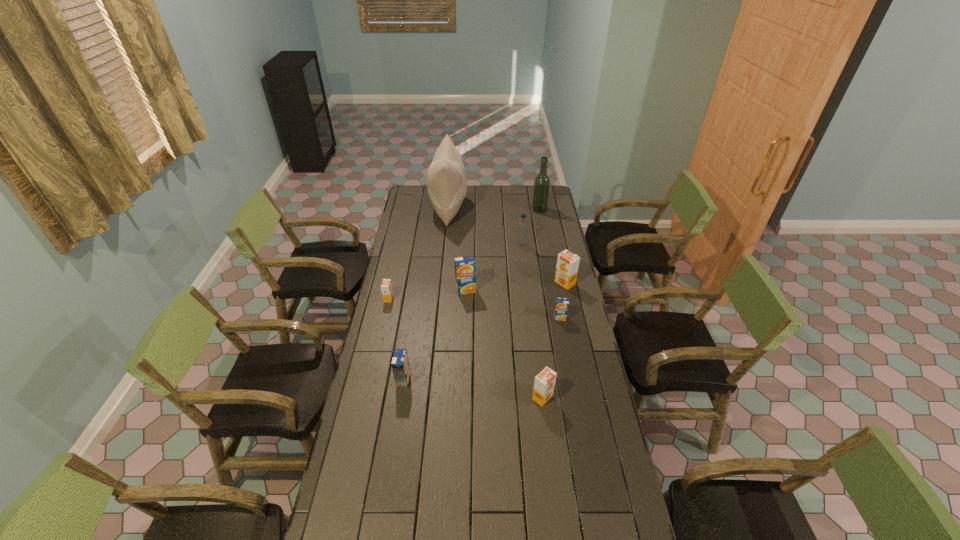
Find the location of a particular element. The width and height of the screenshot is (960, 540). free point located 0.140m on the back of the farthest orange orange juice is located at coordinates (560, 259).

Find the location of a particular element. free location located on the left of the second biggest orange orange juice is located at coordinates (x=468, y=397).

I want to click on vacant space located 0.200m on the back of the second nearest object, so click(411, 334).

Identify the location of vacant region located 0.080m on the back of the leftmost object. (392, 284).

This screenshot has width=960, height=540. I want to click on blank space located 0.210m on the left of the rightmost blue orange_juice, so click(x=507, y=318).

At what (x,y) coordinates should I click in order to perform the action: click on object that is at the far edge. Please return your answer as a coordinate pair (x, y). The height and width of the screenshot is (540, 960). Looking at the image, I should click on (446, 179).

Where is `cushion that is at the left edge`? The image size is (960, 540). cushion that is at the left edge is located at coordinates (446, 179).

I want to click on liquor located at the right edge, so click(x=542, y=181).

You are a GUI agent. You are given a task and a screenshot of the screen. Output one action in this format:
    pyautogui.click(x=<x>, y=<y>)
    Task: Click on the object at the far left corner
    
    Given the screenshot: What is the action you would take?
    pyautogui.click(x=446, y=179)

In the image, there is a desktop. At what (x,y) coordinates should I click in order to perform the action: click on free space at the far edge. Please return your answer as a coordinate pair (x, y). The width and height of the screenshot is (960, 540). Looking at the image, I should click on (514, 199).